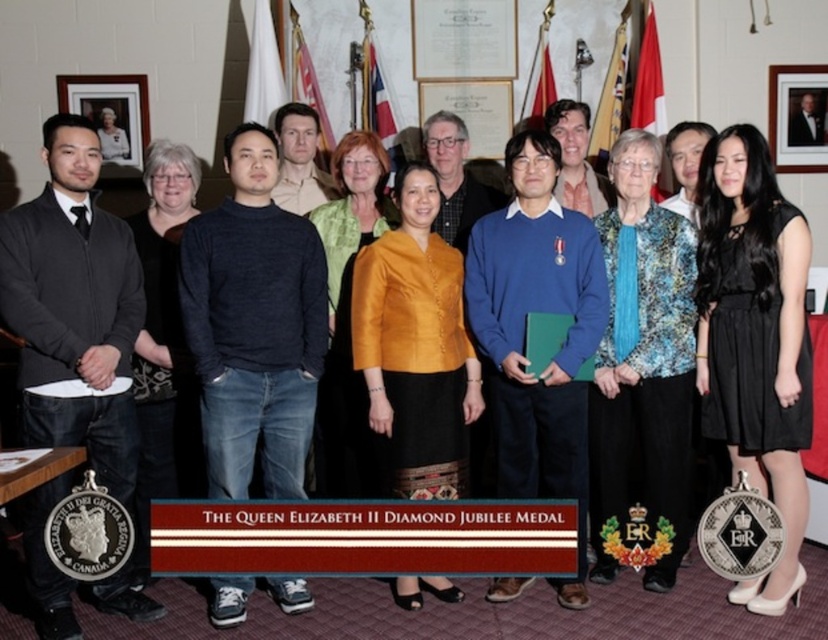
Question: Which point is farther from the camera taking this photo?

Choices:
 (A) (467, 250)
 (B) (600, 486)
 (C) (116, 468)

Answer: (B)

Question: Based on their relative distances, which object is nearer to the wooden picture frame at upper right?

Choices:
 (A) matte black frame at upper left
 (B) black satin dress at center
 (C) blue sweater at center
 (D) matte orange jacket at center

Answer: (B)

Question: Does dark blue sweater at center lie behind matte orange jacket at center?

Choices:
 (A) yes
 (B) no

Answer: (B)

Question: Can you confirm if blue sweater at center is positioned to the left of wooden picture frame at upper right?

Choices:
 (A) yes
 (B) no

Answer: (A)

Question: Is black satin dress at center bigger than blue printed blouse at center?

Choices:
 (A) no
 (B) yes

Answer: (A)

Question: Which point is farther to the camera?

Choices:
 (A) (104, 116)
 (B) (278, 259)
 (C) (706, 260)
 (D) (643, 500)

Answer: (A)